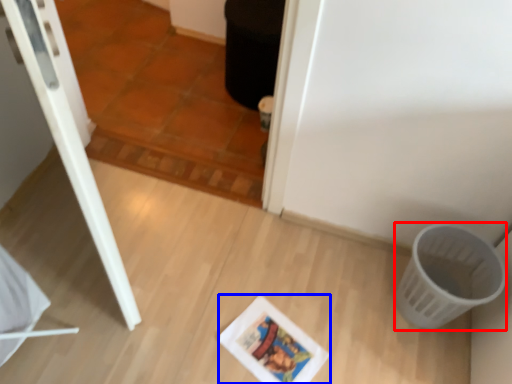
Question: Which object is further to the camera taking this photo, basket (highlighted by a red box) or comic book (highlighted by a blue box)?

Choices:
 (A) basket
 (B) comic book

Answer: (B)